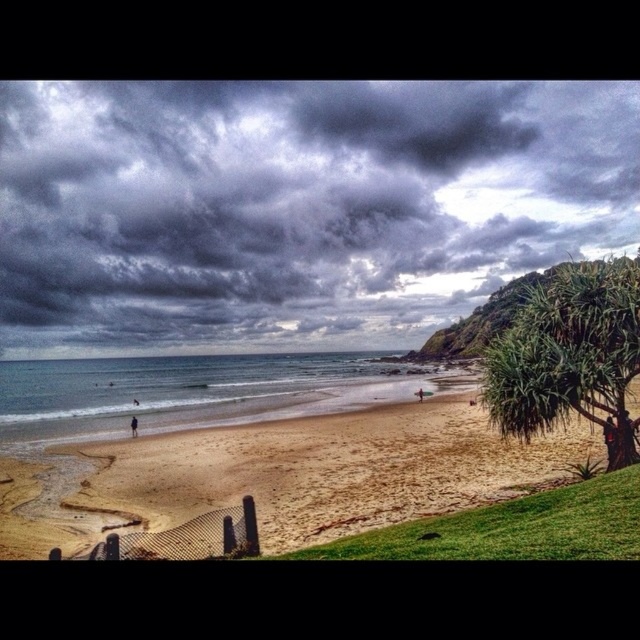
Question: Among these objects, which one is nearest to the camera?

Choices:
 (A) green leafy tree at right
 (B) dark gray cloud at upper center
 (C) sandy beach at lower left
 (D) dark blue fabric at lower left

Answer: (A)

Question: Which of the following is the farthest from the observer?

Choices:
 (A) pink fabric surfboard at center
 (B) dark blue fabric at lower left
 (C) blue water at beach center
 (D) sandy beach at lower left

Answer: (A)

Question: Is sandy beach at lower left thinner than green leafy tree at right?

Choices:
 (A) no
 (B) yes

Answer: (A)

Question: Observing the image, what is the correct spatial positioning of blue water at beach center in reference to dark blue fabric at lower left?

Choices:
 (A) above
 (B) below

Answer: (B)

Question: In this image, where is dark gray cloud at upper center located relative to blue water at beach center?

Choices:
 (A) left
 (B) right

Answer: (B)

Question: Which point is closer to the camera taking this photo?

Choices:
 (A) (422, 392)
 (B) (588, 372)
 (C) (132, 432)

Answer: (B)